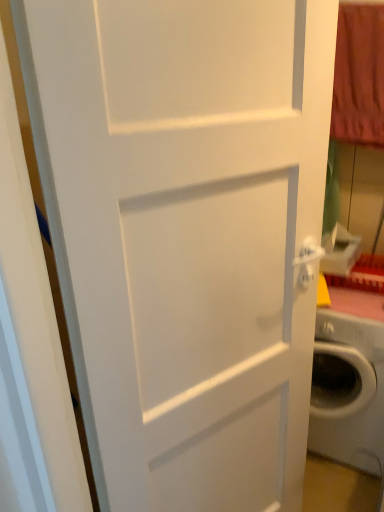
What is the approximate height of velvet burgundy curtain at upper right?

It is 20.22 inches.

The image size is (384, 512). What do you see at coordinates (359, 76) in the screenshot?
I see `velvet burgundy curtain at upper right` at bounding box center [359, 76].

Identify the location of velvet burgundy curtain at upper right. (359, 76).

I want to click on velvet burgundy curtain at upper right, so click(359, 76).